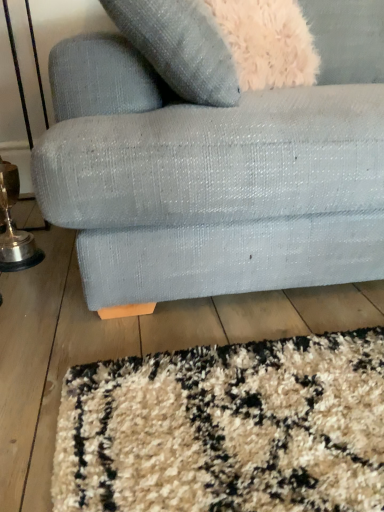
The image size is (384, 512). What do you see at coordinates (13, 227) in the screenshot? I see `gold metallic table lamp at lower left` at bounding box center [13, 227].

What is the approximate width of gold metallic table lamp at lower left?

15.23 centimeters.

The width and height of the screenshot is (384, 512). What are the coordinates of `gold metallic table lamp at lower left` in the screenshot? It's located at (13, 227).

In order to face textured fabric couch at lower center, should I rotate leftwards or rightwards?

A 14.223 degree turn to the right will do.

This screenshot has width=384, height=512. Identify the location of textured fabric couch at lower center. (219, 172).

Describe the element at coordinates (219, 172) in the screenshot. I see `textured fabric couch at lower center` at that location.

Find the location of `gold metallic table lamp at lower left`. gold metallic table lamp at lower left is located at coordinates (13, 227).

Visually, is gold metallic table lamp at lower left positioned to the left or to the right of textured fabric couch at lower center?

In the image, gold metallic table lamp at lower left appears on the left side of textured fabric couch at lower center.

Considering their positions, is gold metallic table lamp at lower left located in front of or behind textured fabric couch at lower center?

In the image, gold metallic table lamp at lower left appears behind textured fabric couch at lower center.

Is point (6, 263) closer or farther from the camera than point (250, 95)?

Point (6, 263).

In the scene shown: From the image's perspective, which one is positioned lower, gold metallic table lamp at lower left or textured fabric couch at lower center?

From the image's view, gold metallic table lamp at lower left is below.

From a real-world perspective, is gold metallic table lamp at lower left on textured fabric couch at lower center?

No, from a real-world perspective, gold metallic table lamp at lower left is not above textured fabric couch at lower center.

Which of these two, gold metallic table lamp at lower left or textured fabric couch at lower center, is thinner?

gold metallic table lamp at lower left.

Who is shorter, gold metallic table lamp at lower left or textured fabric couch at lower center?

gold metallic table lamp at lower left.

Between gold metallic table lamp at lower left and textured fabric couch at lower center, which one has smaller size?

gold metallic table lamp at lower left is smaller.

Is textured fabric couch at lower center completely or partially inside gold metallic table lamp at lower left?

No, textured fabric couch at lower center is not surrounded by gold metallic table lamp at lower left.

Are gold metallic table lamp at lower left and textured fabric couch at lower center located far from each other?

gold metallic table lamp at lower left is near textured fabric couch at lower center, not far away.

Is gold metallic table lamp at lower left oriented towards textured fabric couch at lower center?

Yes, gold metallic table lamp at lower left is turned towards textured fabric couch at lower center.

How much distance is there between gold metallic table lamp at lower left and textured fabric couch at lower center?

They are 61.32 centimeters apart.

Locate an element on the screen. This screenshot has height=512, width=384. studio couch in front of the gold metallic table lamp at lower left is located at coordinates (219, 172).

Which object is positioned more to the right, textured fabric couch at lower center or gold metallic table lamp at lower left?

textured fabric couch at lower center is more to the right.

Is the position of textured fabric couch at lower center less distant than that of gold metallic table lamp at lower left?

Yes, it is.

Is point (95, 112) closer or farther from the camera than point (0, 263)?

Point (95, 112).

From the image's perspective, is textured fabric couch at lower center located beneath gold metallic table lamp at lower left?

Incorrect, from the image's perspective, textured fabric couch at lower center is higher than gold metallic table lamp at lower left.

From a real-world perspective, between textured fabric couch at lower center and gold metallic table lamp at lower left, who is vertically lower?

gold metallic table lamp at lower left, from a real-world perspective.

In terms of width, does textured fabric couch at lower center look wider or thinner when compared to gold metallic table lamp at lower left?

Considering their sizes, textured fabric couch at lower center looks broader than gold metallic table lamp at lower left.

Looking at this image, who is taller, textured fabric couch at lower center or gold metallic table lamp at lower left?

textured fabric couch at lower center is taller.

Considering the relative sizes of textured fabric couch at lower center and gold metallic table lamp at lower left in the image provided, is textured fabric couch at lower center smaller than gold metallic table lamp at lower left?

No.

Is textured fabric couch at lower center situated inside gold metallic table lamp at lower left or outside?

textured fabric couch at lower center exists outside the volume of gold metallic table lamp at lower left.

Is textured fabric couch at lower center far away from gold metallic table lamp at lower left?

No, textured fabric couch at lower center is not far away from gold metallic table lamp at lower left.

Could you tell me if textured fabric couch at lower center is facing gold metallic table lamp at lower left?

No, textured fabric couch at lower center is not aimed at gold metallic table lamp at lower left.

Looking at this image, what's the angular difference between textured fabric couch at lower center and gold metallic table lamp at lower left's facing directions?

There is a 90.4-degree angle between the facing directions of textured fabric couch at lower center and gold metallic table lamp at lower left.

Where is `table lamp located behind the textured fabric couch at lower center`? table lamp located behind the textured fabric couch at lower center is located at coordinates (13, 227).

This screenshot has width=384, height=512. I want to click on studio couch that appears above the gold metallic table lamp at lower left (from a real-world perspective), so click(x=219, y=172).

Find the location of a particular element. The height and width of the screenshot is (512, 384). table lamp located behind the textured fabric couch at lower center is located at coordinates (13, 227).